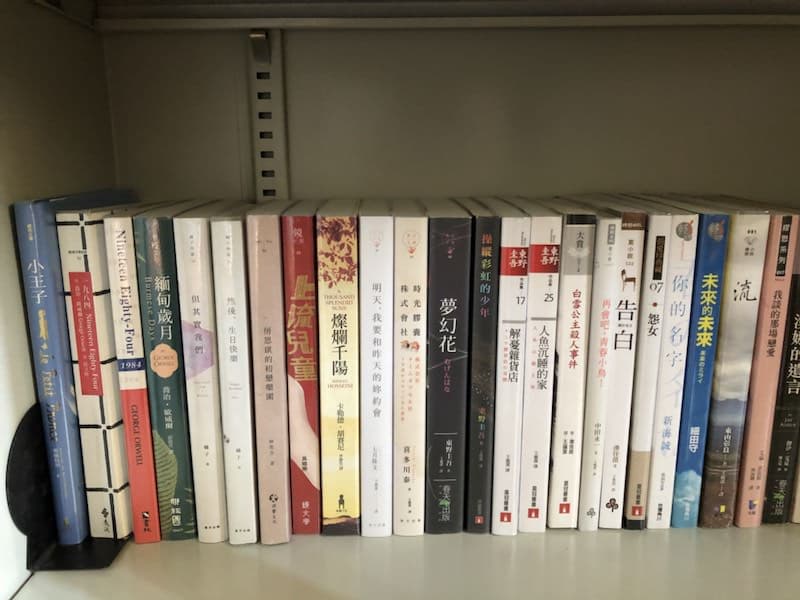
At what (x,y) coordinates should I click in order to perform the action: click on notches on metal piece in back of shelf. Please return your answer as a coordinate pair (x, y). The width and height of the screenshot is (800, 600). Looking at the image, I should click on (270, 193), (269, 174), (266, 154), (265, 135), (265, 115), (264, 94), (264, 76).